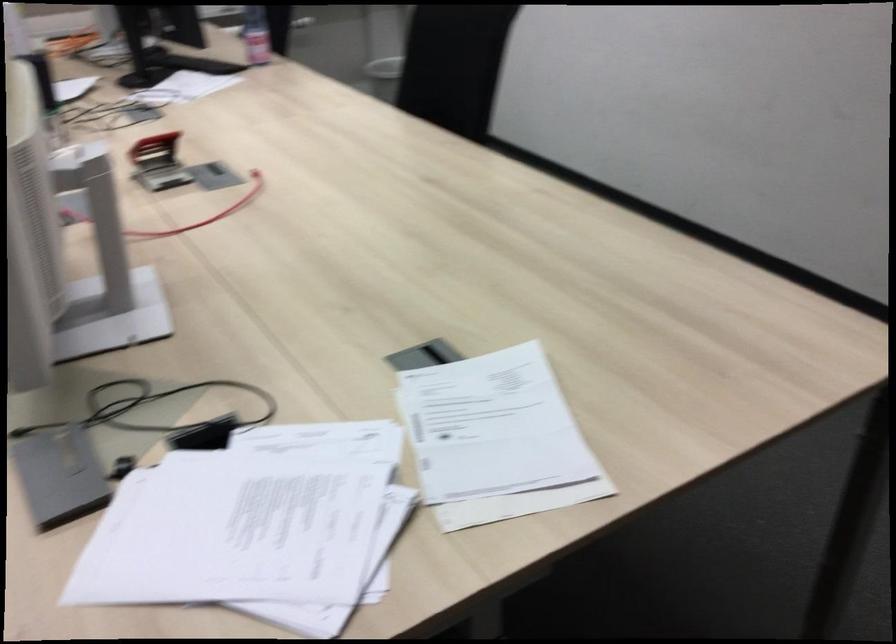
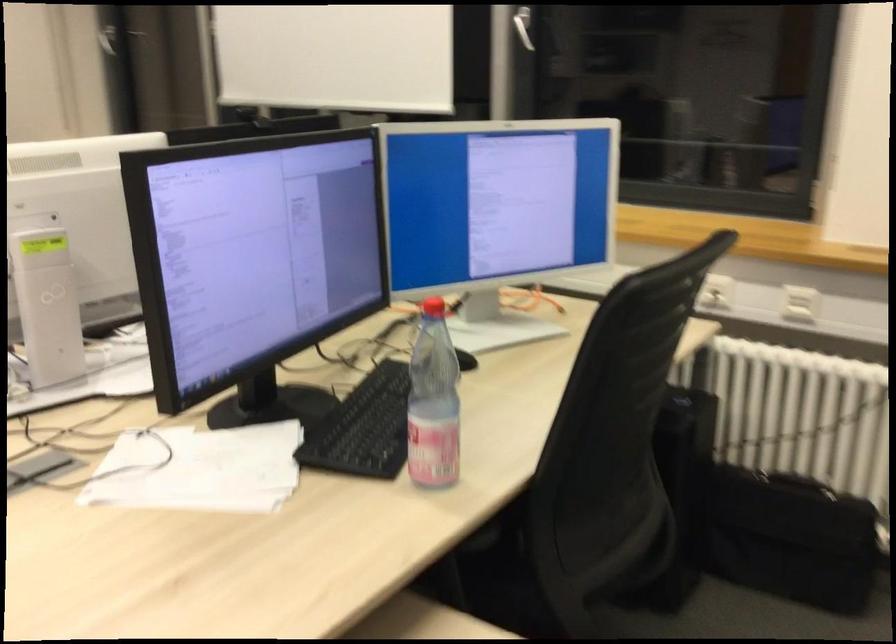
Where in the second image is the point corresponding to (185,100) from the first image?

(199, 469)